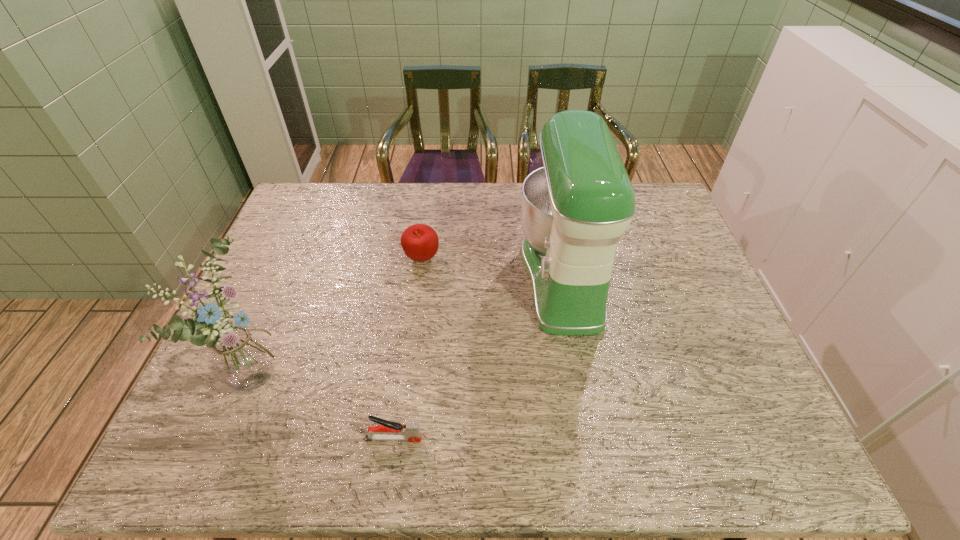
The width and height of the screenshot is (960, 540). In order to click on vacant region that satisfies the following two spatial constraints: 1. on the front side of the apple; 2. on the front-facing side of the bouquet in this screenshot , I will do `click(407, 371)`.